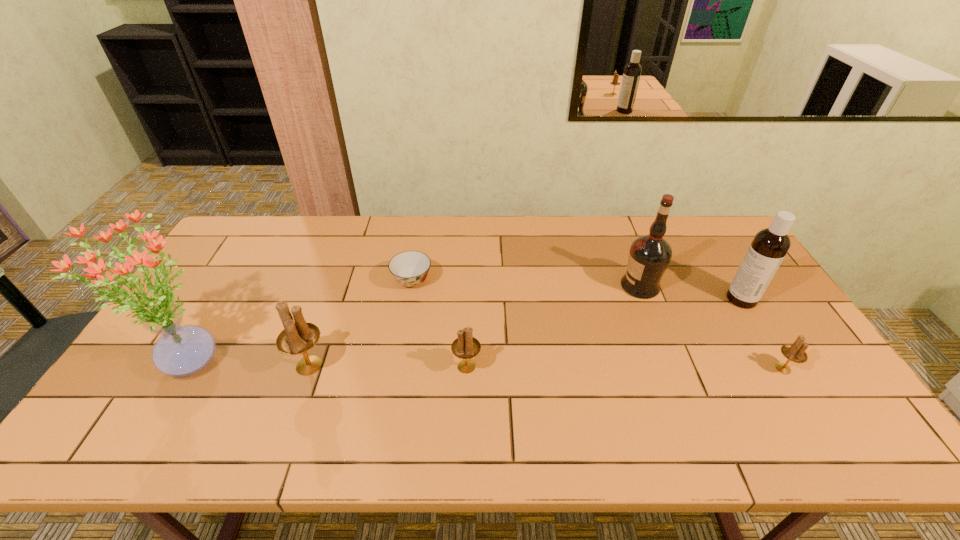
The height and width of the screenshot is (540, 960). In order to click on free space in the image that satisfies the following two spatial constraints: 1. on the front side of the soup bowl; 2. on the right side of the second candle holder from left to right in this screenshot , I will do `click(397, 367)`.

You are a GUI agent. You are given a task and a screenshot of the screen. Output one action in this format:
    pyautogui.click(x=<x>, y=<y>)
    Task: Click on the vacant point that satisfies the following two spatial constraints: 1. on the back side of the shortest object; 2. on the left side of the fourth shortest object
    
    Given the screenshot: What is the action you would take?
    pyautogui.click(x=339, y=281)